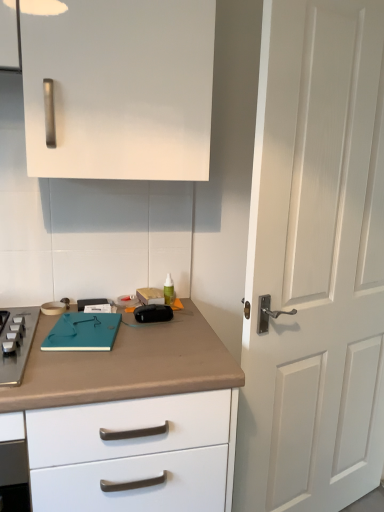
Find the location of a particular element. This screenshot has height=512, width=384. white matte door at right is located at coordinates (315, 262).

Measure the distance between white matte door at right and camera.

The depth of white matte door at right is 3.52 feet.

At what (x,y) coordinates should I click in order to perform the action: click on teal matte notebook at center. Please return your answer as a coordinate pair (x, y). Looking at the image, I should click on (83, 332).

Based on the photo, is teal matte notebook at center outside of white matte door at right?

Yes.

Can you confirm if teal matte notebook at center is wider than white matte door at right?

Yes.

Is point (99, 317) farther from viewer compared to point (291, 446)?

No, (99, 317) is closer to viewer.

Based on their sizes in the image, would you say teal matte notebook at center is bigger or smaller than white matte door at right?

Clearly, teal matte notebook at center is smaller in size than white matte door at right.

The image size is (384, 512). I want to click on countertop lying below the white matte door at right (from the image's perspective), so click(x=132, y=370).

Consider the image. From a real-world perspective, who is located higher, white matte door at right or brown matte countertop at lower left?

white matte door at right, from a real-world perspective.

Considering the sizes of white matte door at right and brown matte countertop at lower left in the image, is white matte door at right bigger or smaller than brown matte countertop at lower left?

white matte door at right is smaller than brown matte countertop at lower left.

Is white matte door at right touching brown matte countertop at lower left?

They are not placed beside each other.

Considering the points (40, 358) and (89, 348), which point is in front, point (40, 358) or point (89, 348)?

Point (40, 358)

Considering the sizes of brown matte countertop at lower left and teal matte notebook at center in the image, is brown matte countertop at lower left taller or shorter than teal matte notebook at center?

Considering their sizes, brown matte countertop at lower left has more height than teal matte notebook at center.

Would you say brown matte countertop at lower left is inside or outside teal matte notebook at center?

brown matte countertop at lower left is outside teal matte notebook at center.

From a real-world perspective, is white matte door at right above or below teal matte notebook at center?

From a real-world perspective, white matte door at right is physically above teal matte notebook at center.

From the image's perspective, which one is positioned lower, white matte door at right or teal matte notebook at center?

teal matte notebook at center is shown below in the image.

Between white matte door at right and teal matte notebook at center, which one appears on the right side from the viewer's perspective?

white matte door at right.

Is white matte door at right not within teal matte notebook at center?

Yes.

Considering the positions of objects brown matte countertop at lower left and white matte door at right in the image provided, who is behind, brown matte countertop at lower left or white matte door at right?

white matte door at right is further away from the camera.

Is brown matte countertop at lower left directly adjacent to white matte door at right?

No, brown matte countertop at lower left is not with white matte door at right.

Considering the relative sizes of brown matte countertop at lower left and white matte door at right in the image provided, is brown matte countertop at lower left thinner than white matte door at right?

No.

How different are the orientations of brown matte countertop at lower left and white matte door at right in degrees?

18.7 degrees.

What's the angular difference between teal matte notebook at center and brown matte countertop at lower left's facing directions?

The facing directions of teal matte notebook at center and brown matte countertop at lower left are 11.2 degrees apart.

From the image's perspective, is teal matte notebook at center located above or below brown matte countertop at lower left?

Clearly, from the image's perspective, teal matte notebook at center is above brown matte countertop at lower left.

Looking at this image, between teal matte notebook at center and brown matte countertop at lower left, which one is positioned behind?

teal matte notebook at center is further away from the camera.

Does teal matte notebook at center have a lesser height compared to brown matte countertop at lower left?

Indeed, teal matte notebook at center has a lesser height compared to brown matte countertop at lower left.

Identify the location of notepad that appears below the white matte door at right (from a real-world perspective). This screenshot has height=512, width=384. (83, 332).

This screenshot has width=384, height=512. I want to click on door on the right of brown matte countertop at lower left, so click(x=315, y=262).

Estimate the real-world distances between objects in this image. Which object is further from brown matte countertop at lower left, white matte door at right or teal matte notebook at center?

white matte door at right is further to brown matte countertop at lower left.

Considering their positions, is brown matte countertop at lower left positioned further to teal matte notebook at center than white matte door at right?

white matte door at right is positioned further to the anchor teal matte notebook at center.

Considering their positions, is white matte door at right positioned closer to teal matte notebook at center than brown matte countertop at lower left?

Based on the image, brown matte countertop at lower left appears to be nearer to teal matte notebook at center.

From the image, which object appears to be nearer to white matte door at right, brown matte countertop at lower left or teal matte notebook at center?

brown matte countertop at lower left is positioned closer to the anchor white matte door at right.

Based on their spatial positions, is teal matte notebook at center or white matte door at right further from brown matte countertop at lower left?

white matte door at right.

From the image, which object appears to be nearer to white matte door at right, teal matte notebook at center or brown matte countertop at lower left?

The object closer to white matte door at right is brown matte countertop at lower left.

Locate an element on the screen. The image size is (384, 512). countertop situated between teal matte notebook at center and white matte door at right from left to right is located at coordinates (132, 370).